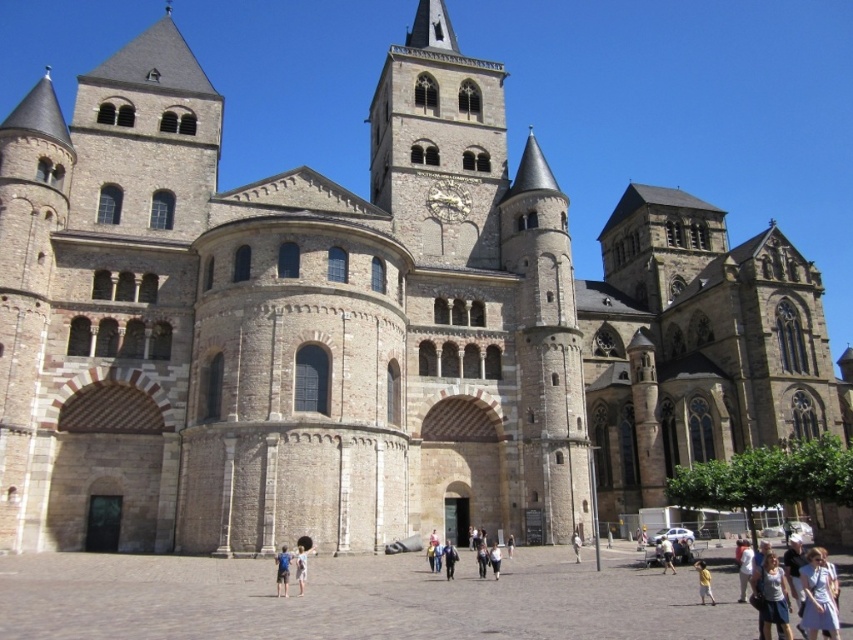
Is point (701, 582) in front of point (663, 554)?

That is True.

Identify the location of yellow cotton shirt at lower right. The width and height of the screenshot is (853, 640). (703, 580).

Can you confirm if blue denim shorts at center is positioned below light brown leather jacket at center?

No, blue denim shorts at center is not below light brown leather jacket at center.

Who is more distant from viewer, (285, 552) or (660, 538)?

The point (660, 538) is more distant.

I want to click on blue denim shorts at center, so click(282, 570).

From the picture: Which of these two, light blue denim jeans at center or white cotton shirt at center, stands taller?

With more height is light blue denim jeans at center.

Is light blue denim jeans at center shorter than white cotton shirt at center?

No.

Between point (299, 554) and point (581, 544), which one is positioned in front?

Point (299, 554) is more forward.

At what (x,y) coordinates should I click in order to perform the action: click on light blue denim jeans at center. Please return your answer as a coordinate pair (x, y). Looking at the image, I should click on (300, 566).